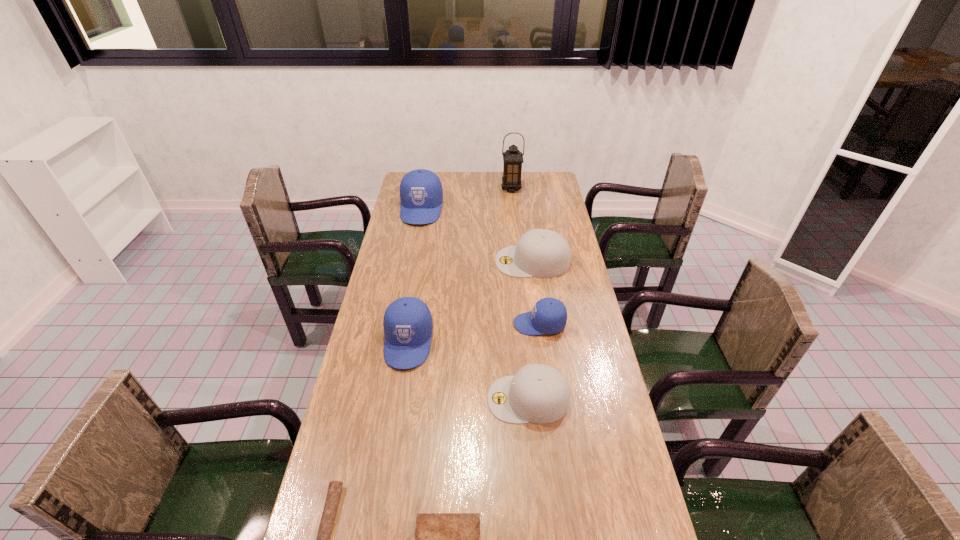
Where is `black lantern`? black lantern is located at coordinates (513, 158).

You are a GUI agent. You are given a task and a screenshot of the screen. Output one action in this format:
    pyautogui.click(x=<x>, y=<y>)
    Task: Click on the lantern
    
    Given the screenshot: What is the action you would take?
    [513, 158]

You are a GUI agent. You are given a task and a screenshot of the screen. Output one action in this format:
    pyautogui.click(x=<x>, y=<y>)
    Task: Click on the biggest blue cap
    The width and height of the screenshot is (960, 540).
    Given the screenshot: What is the action you would take?
    pyautogui.click(x=421, y=194)

In order to click on the farthest cap in this screenshot , I will do `click(421, 194)`.

What are the coordinates of `the second smallest blue cap` in the screenshot? It's located at (x=408, y=326).

Find the location of `the bigger gray cap`. the bigger gray cap is located at coordinates (543, 253).

This screenshot has width=960, height=540. I want to click on the third farthest object, so click(x=543, y=253).

The image size is (960, 540). Identify the location of the nearer gray cap. (538, 393).

Where is `the sixth farthest object`? This screenshot has height=540, width=960. the sixth farthest object is located at coordinates (538, 393).

The width and height of the screenshot is (960, 540). Identify the location of the smallest blue cap. (549, 315).